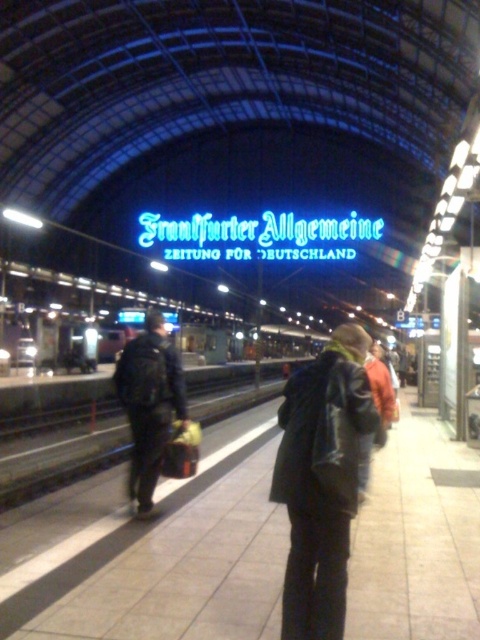
Question: Does leather jacket at center have a smaller size compared to dark blue leather jacket at center?

Choices:
 (A) no
 (B) yes

Answer: (B)

Question: Among these points, which one is farthest from the camera?

Choices:
 (A) (277, 477)
 (B) (169, 387)

Answer: (B)

Question: Is leather jacket at center bigger than dark blue leather jacket at center?

Choices:
 (A) no
 (B) yes

Answer: (A)

Question: Is leather jacket at center to the right of dark blue leather jacket at center from the viewer's perspective?

Choices:
 (A) yes
 (B) no

Answer: (A)

Question: Which object appears closest to the camera in this image?

Choices:
 (A) dark blue leather jacket at center
 (B) leather jacket at center

Answer: (B)

Question: Which point appears farthest from the camera in this image?

Choices:
 (A) pyautogui.click(x=333, y=417)
 (B) pyautogui.click(x=149, y=477)

Answer: (B)